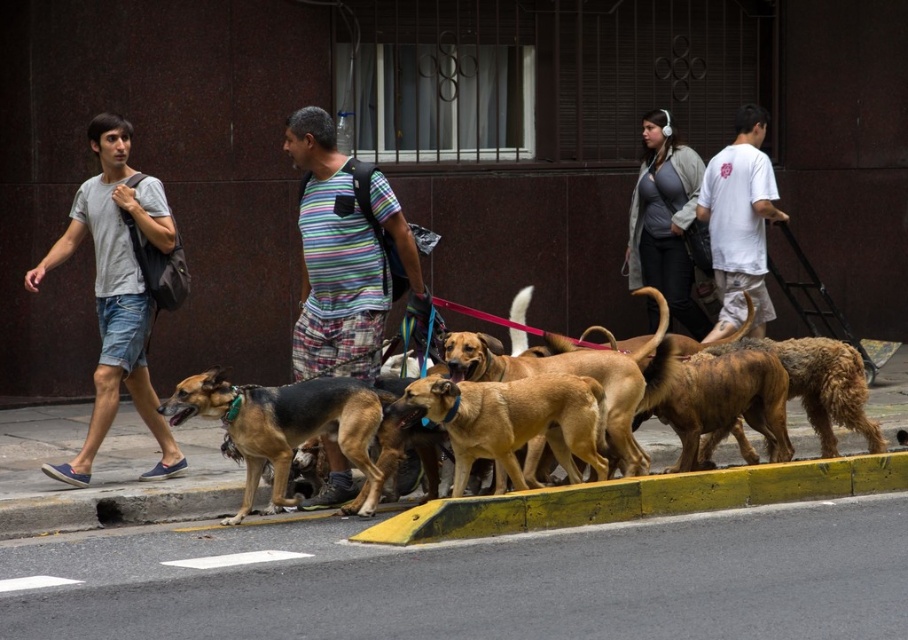
You are a delivery robot with a width of 2 feet. You need to navigate through the street scene shown in the image. Can you safely pass between the yellow asphalt at lower center and the yellow rubber curb at lower center?

The yellow asphalt at lower center and yellow rubber curb at lower center are 4.29 feet apart from each other. Since the robot is 2 feet wide, there is sufficient space to pass safely between them as the distance is greater than the robot width.

You are standing on the sidewalk in the urban street scene. There is a point marked at coordinates point (479, 580). What type of surface is this point located on?

The point (479, 580) is located on yellow asphalt at lower center.